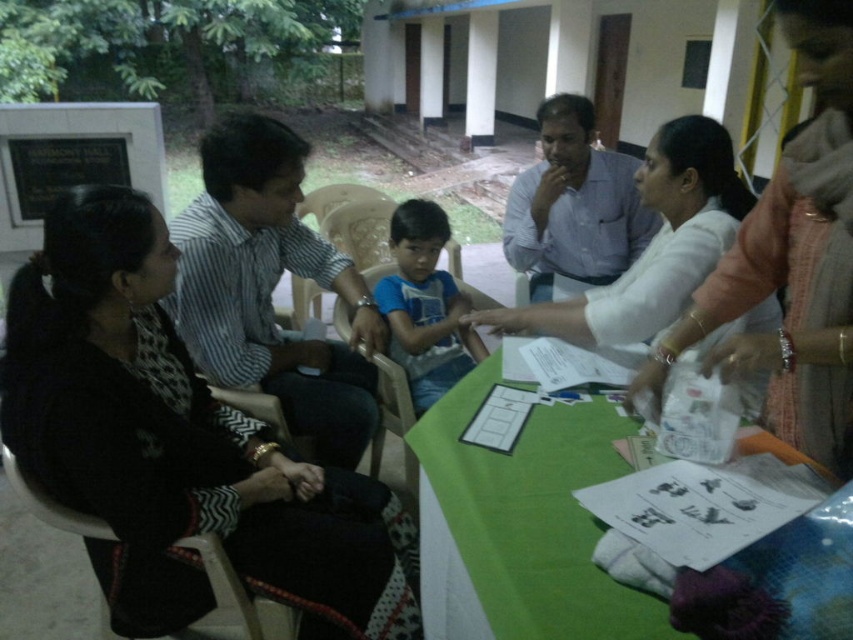
Question: Is striped cotton shirt at center thinner than blue cotton shirt at center?

Choices:
 (A) yes
 (B) no

Answer: (B)

Question: Is white fabric saree at center bigger than blue cotton shirt at center?

Choices:
 (A) yes
 (B) no

Answer: (A)

Question: Based on their relative distances, which object is nearer to the matte white shirt at center?

Choices:
 (A) white fabric saree at center
 (B) plastic chair at center
 (C) black fabric dress at left

Answer: (B)

Question: Can you confirm if white cloth at center is positioned to the right of blue cotton shirt at center?

Choices:
 (A) no
 (B) yes

Answer: (B)

Question: Which point appears closest to the camera in this image?

Choices:
 (A) (628, 205)
 (B) (373, 394)
 (C) (785, 432)

Answer: (C)

Question: Estimate the real-world distances between objects in this image. Which object is closer to the green fabric table at lower center?

Choices:
 (A) white cloth at center
 (B) striped cotton shirt at center
 (C) black fabric dress at left

Answer: (A)